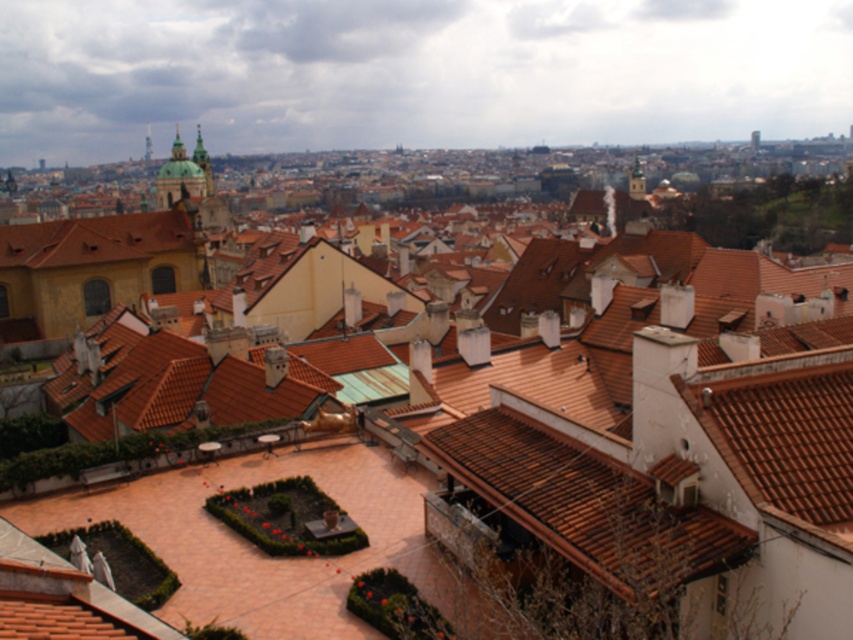
Question: Which of the following is the farthest from the observer?

Choices:
 (A) (149, 243)
 (B) (666, 472)

Answer: (A)

Question: Is brown tile roof at center above matte orange tile roof at left?

Choices:
 (A) no
 (B) yes

Answer: (A)

Question: Among these points, which one is farthest from the camera?

Choices:
 (A) (613, 486)
 (B) (15, 225)

Answer: (B)

Question: Is brown tile roof at center wider than matte orange tile roof at left?

Choices:
 (A) yes
 (B) no

Answer: (B)

Question: Considering the relative positions of brown tile roof at center and matte orange tile roof at left in the image provided, where is brown tile roof at center located with respect to matte orange tile roof at left?

Choices:
 (A) below
 (B) above

Answer: (A)